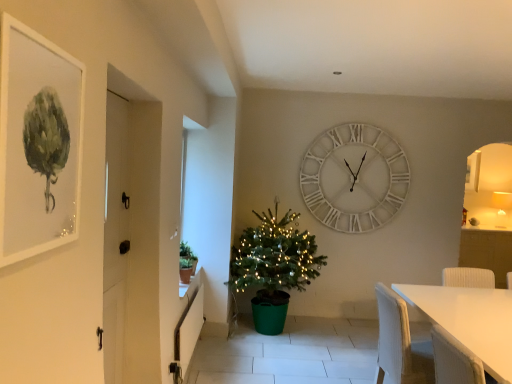
You are a GUI agent. You are given a task and a screenshot of the screen. Output one action in this format:
    pyautogui.click(x=<x>, y=<y>)
    Task: Click on the white wooden clock at upper center
    The image size is (512, 384).
    Given the screenshot: What is the action you would take?
    pyautogui.click(x=354, y=178)

This screenshot has height=384, width=512. What do you see at coordinates (186, 262) in the screenshot?
I see `green matte plant at left` at bounding box center [186, 262].

Measure the distance between white wooden door at left and camera.

The depth of white wooden door at left is 2.16 meters.

Find the location of `white wooden door at left`. white wooden door at left is located at coordinates (115, 233).

Describe the element at coordinates (38, 143) in the screenshot. The width and height of the screenshot is (512, 384). I see `matte white picture frame at upper left` at that location.

Locate an element on the screen. The height and width of the screenshot is (384, 512). white wooden clock at upper center is located at coordinates (354, 178).

Considering the relative sizes of matte white picture frame at upper left and white matte table at lower right in the image provided, is matte white picture frame at upper left shorter than white matte table at lower right?

Correct, matte white picture frame at upper left is not as tall as white matte table at lower right.

Which is in front, matte white picture frame at upper left or white matte table at lower right?

matte white picture frame at upper left.

Is matte white picture frame at upper left facing towards white matte table at lower right?

No, matte white picture frame at upper left is not turned towards white matte table at lower right.

Can white matte table at lower right be found inside matte white picture frame at upper left?

No.

The image size is (512, 384). Identify the location of wall clock to the right of green plastic christmas tree at center. (354, 178).

From a real-world perspective, which is physically above, white wooden clock at upper center or green plastic christmas tree at center?

In real-world perspective, white wooden clock at upper center is above.

Is white wooden clock at upper center positioned in front of green plastic christmas tree at center?

No, white wooden clock at upper center is further to the viewer.

From the image's perspective, is white wooden clock at upper center below matte white picture frame at upper left?

No, from the image's perspective, white wooden clock at upper center is not beneath matte white picture frame at upper left.

Can you confirm if white wooden clock at upper center is shorter than matte white picture frame at upper left?

In fact, white wooden clock at upper center may be taller than matte white picture frame at upper left.

Is white wooden clock at upper center looking in the opposite direction of matte white picture frame at upper left?

That's not correct — white wooden clock at upper center is not looking away from matte white picture frame at upper left.

From a real-world perspective, is white matte table at lower right located higher than white wooden door at left?

Actually, white matte table at lower right is physically below white wooden door at left in the real world.

How many degrees apart are the facing directions of white matte table at lower right and white wooden door at left?

4.44 degrees separate the facing orientations of white matte table at lower right and white wooden door at left.

Considering the relative positions of white matte table at lower right and white wooden door at left in the image provided, is white matte table at lower right to the left of white wooden door at left from the viewer's perspective?

No, white matte table at lower right is not to the left of white wooden door at left.

Which is behind, white matte table at lower right or white wooden door at left?

white matte table at lower right is further from the camera.

Visually, is white matte table at lower right positioned to the left or to the right of matte white picture frame at upper left?

From the image, it's evident that white matte table at lower right is to the right of matte white picture frame at upper left.

Is white matte table at lower right not inside matte white picture frame at upper left?

Absolutely, white matte table at lower right is external to matte white picture frame at upper left.

Is white matte table at lower right thinner than matte white picture frame at upper left?

In fact, white matte table at lower right might be wider than matte white picture frame at upper left.

From the image's perspective, which object appears higher, white matte table at lower right or matte white picture frame at upper left?

matte white picture frame at upper left is shown above in the image.

Find the location of a particular element. This screenshot has height=384, width=512. door located underneath the matte white picture frame at upper left (from a real-world perspective) is located at coordinates (115, 233).

Between white wooden door at left and matte white picture frame at upper left, which one has smaller width?

matte white picture frame at upper left.

Which is farther, (114, 121) or (28, 100)?

The point (114, 121) is behind.

Can you tell me how much matte white picture frame at upper left and white wooden clock at upper center differ in facing direction?

There is a 90.9-degree angle between the facing directions of matte white picture frame at upper left and white wooden clock at upper center.

Are matte white picture frame at upper left and white wooden clock at upper center making contact?

They are not placed beside each other.

Which of these two, matte white picture frame at upper left or white wooden clock at upper center, is bigger?

white wooden clock at upper center is bigger.

In the image, there is a matte white picture frame at upper left. Where is `table below it (from the image's perspective)`? table below it (from the image's perspective) is located at coordinates (470, 320).

The height and width of the screenshot is (384, 512). What are the coordinates of `christmas tree below the white wooden clock at upper center (from a real-world perspective)` in the screenshot? It's located at (273, 267).

Estimate the real-world distances between objects in this image. Which object is further from white matte table at lower right, matte white picture frame at upper left or green plastic christmas tree at center?

matte white picture frame at upper left.

Based on their spatial positions, is green plastic christmas tree at center or matte white picture frame at upper left further from white wooden door at left?

The object further to white wooden door at left is green plastic christmas tree at center.

When comparing their distances from white matte table at lower right, does white wooden clock at upper center or green matte plant at left seem closer?

green matte plant at left is closer to white matte table at lower right.

When comparing their distances from white wooden door at left, does white matte table at lower right or matte white picture frame at upper left seem further?

white matte table at lower right is further to white wooden door at left.

Which object lies nearer to the anchor point green matte plant at left, white wooden door at left or green plastic christmas tree at center?

green plastic christmas tree at center.

Which object lies further to the anchor point green matte plant at left, white matte table at lower right or green plastic christmas tree at center?

white matte table at lower right is positioned further to the anchor green matte plant at left.

Consider the image. Which object lies nearer to the anchor point green matte plant at left, matte white picture frame at upper left or white matte table at lower right?

white matte table at lower right lies closer to green matte plant at left than the other object.

Based on the photo, which object lies further to the anchor point white matte table at lower right, green plastic christmas tree at center or white wooden door at left?

white wooden door at left is further to white matte table at lower right.

Where is `table between matte white picture frame at upper left and green plastic christmas tree at center in the front-back direction`? table between matte white picture frame at upper left and green plastic christmas tree at center in the front-back direction is located at coordinates (470, 320).

At what (x,y) coordinates should I click in order to perform the action: click on door located between matte white picture frame at upper left and green plastic christmas tree at center in the depth direction. Please return your answer as a coordinate pair (x, y). Looking at the image, I should click on (115, 233).

Identify the location of picture frame between white wooden door at left and white matte table at lower right. coord(38,143).

The height and width of the screenshot is (384, 512). What are the coordinates of `table between white wooden door at left and green plastic christmas tree at center in the front-back direction` in the screenshot? It's located at (470, 320).